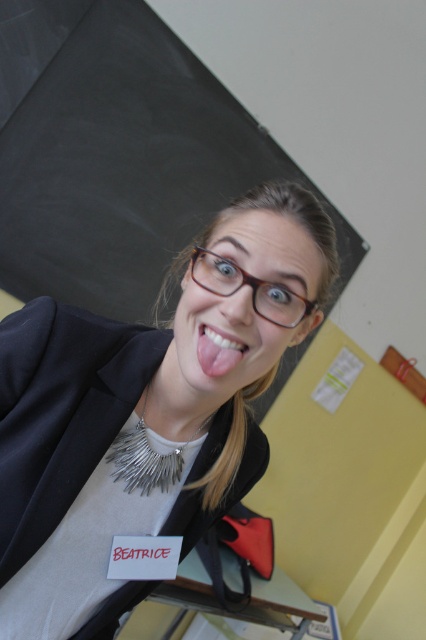
Between matte black blazer at center and brown matte glasses at center, which one has less height?

Standing shorter between the two is brown matte glasses at center.

This screenshot has width=426, height=640. What do you see at coordinates (144, 413) in the screenshot? I see `matte black blazer at center` at bounding box center [144, 413].

What do you see at coordinates (144, 413) in the screenshot? The width and height of the screenshot is (426, 640). I see `matte black blazer at center` at bounding box center [144, 413].

Find the location of `matte black blazer at center`. matte black blazer at center is located at coordinates (144, 413).

This screenshot has height=640, width=426. Identify the location of brown matte glasses at center. (250, 285).

Which is behind, point (233, 282) or point (204, 358)?

The point (233, 282) is behind.

The width and height of the screenshot is (426, 640). I want to click on brown matte glasses at center, so click(250, 285).

Identify the location of yellow matte bulletin board at upper center. (118, 154).

Based on the photo, between yellow matte bulletin board at upper center and brown matte glasses at center, which one has more height?

Standing taller between the two is yellow matte bulletin board at upper center.

Locate an element on the screen. The height and width of the screenshot is (640, 426). yellow matte bulletin board at upper center is located at coordinates (118, 154).

Find the location of a particular element. This screenshot has width=426, height=640. yellow matte bulletin board at upper center is located at coordinates (118, 154).